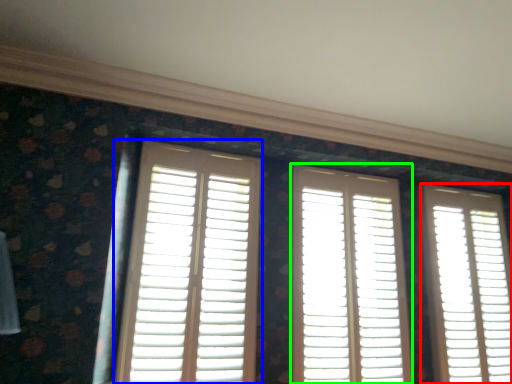
Question: Which object is the farthest from window (highlighted by a red box)? Choose among these: window (highlighted by a blue box) or window (highlighted by a green box).

Choices:
 (A) window
 (B) window

Answer: (A)